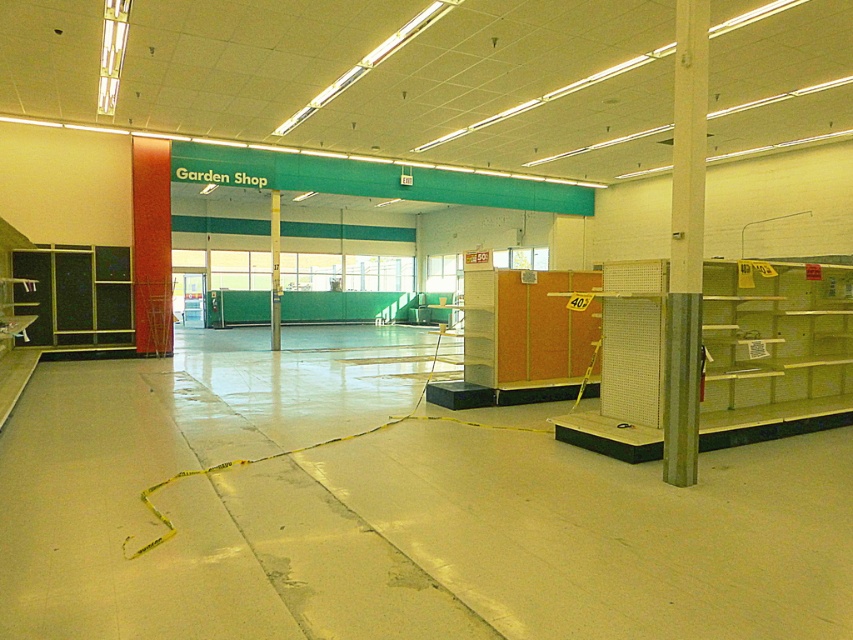
Consider the image. You are a delivery person entering the Garden Shop and need to place a large box between the matte black cabinet at left and the green painted wood pillar at center. Can you fit the box in the space between them?

The matte black cabinet at left is thinner than the green painted wood pillar at center, so the space between them may be sufficient to fit the box, but the exact dimensions of the box and the gap are needed for a precise determination.